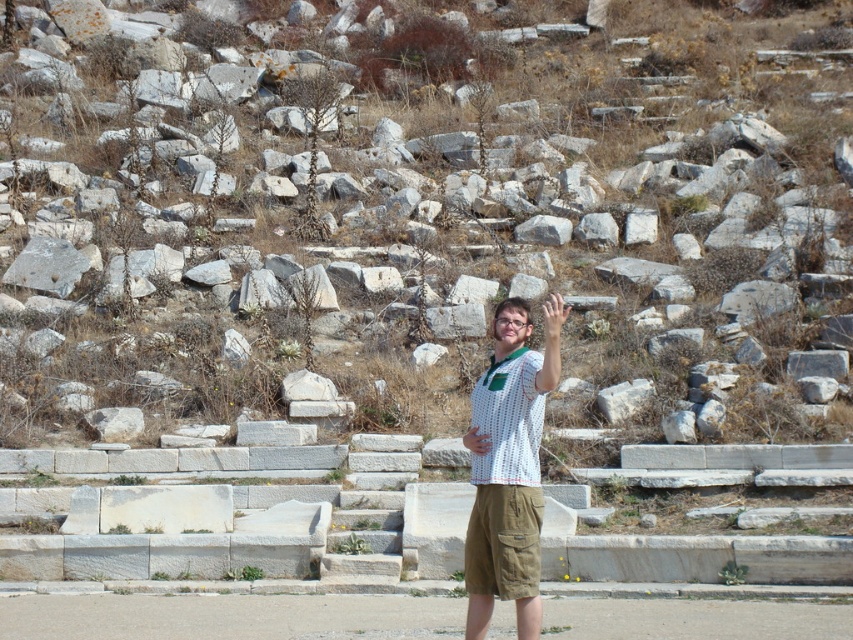
Question: Can you confirm if white dotted shirt at center is thinner than khaki cotton shorts at center?

Choices:
 (A) no
 (B) yes

Answer: (B)

Question: Among these points, which one is nearest to the camera?

Choices:
 (A) (747, 321)
 (B) (524, 392)

Answer: (B)

Question: Can you confirm if white dotted shirt at center is thinner than khaki cotton shorts at center?

Choices:
 (A) yes
 (B) no

Answer: (A)

Question: Is white dotted shirt at center bigger than khaki cotton shorts at center?

Choices:
 (A) yes
 (B) no

Answer: (B)

Question: Which object appears closest to the camera in this image?

Choices:
 (A) white dotted shirt at center
 (B) khaki cotton shorts at center
 (C) white stone steps at center

Answer: (B)

Question: Estimate the real-world distances between objects in this image. Which object is closer to the white dotted shirt at center?

Choices:
 (A) khaki cotton shorts at center
 (B) white stone steps at center

Answer: (A)